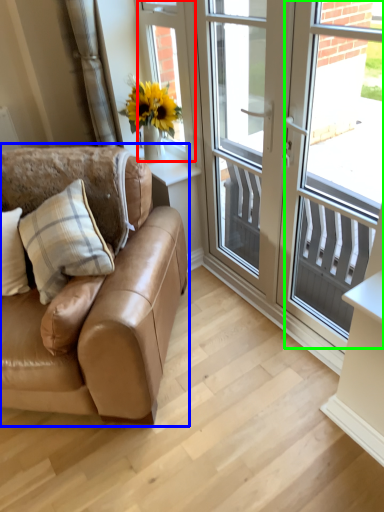
Question: Which object is the farthest from window screen (highlighted by a red box)? Choose among these: studio couch (highlighted by a blue box) or window screen (highlighted by a green box).

Choices:
 (A) studio couch
 (B) window screen

Answer: (B)